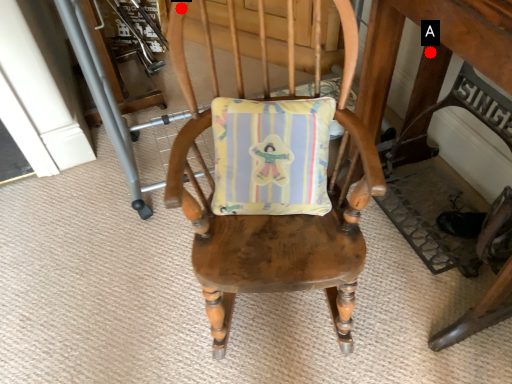
Question: Two points are circled on the image, labeled by A and B beside each circle. Which point is further to the camera?

Choices:
 (A) A is further
 (B) B is further

Answer: (A)